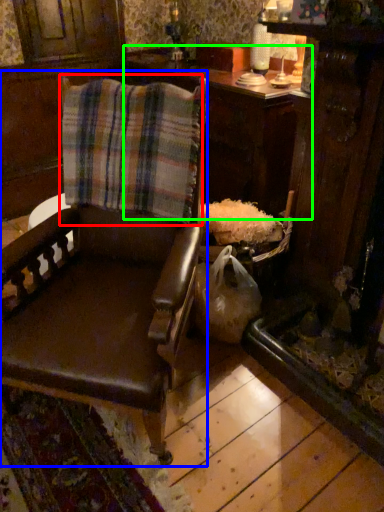
Question: Which object is the farthest from flannel (highlighted by a red box)? Choose among these: chair (highlighted by a blue box) or table (highlighted by a green box).

Choices:
 (A) chair
 (B) table

Answer: (B)